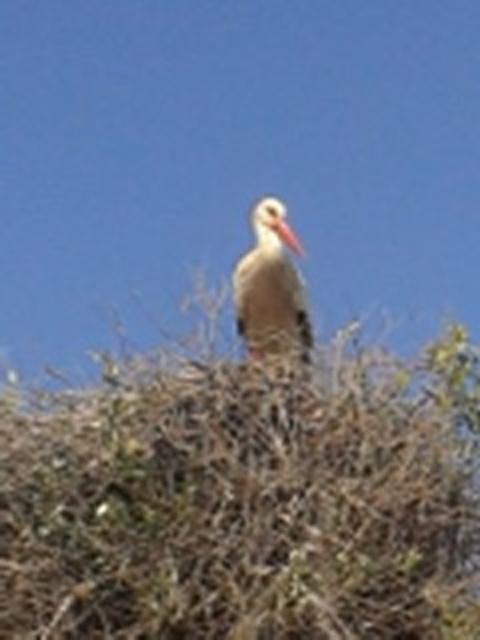
Question: Can you confirm if white matte bird at center is bigger than white matte beak at center?

Choices:
 (A) no
 (B) yes

Answer: (B)

Question: Estimate the real-world distances between objects in this image. Which object is farther from the brown textured nest at upper center?

Choices:
 (A) white matte bird at center
 (B) white matte beak at center

Answer: (B)

Question: Which object is farther from the camera taking this photo?

Choices:
 (A) brown textured nest at upper center
 (B) white matte beak at center
 (C) white matte bird at center

Answer: (B)

Question: Is white matte bird at center thinner than white matte beak at center?

Choices:
 (A) yes
 (B) no

Answer: (B)

Question: Which of the following is the farthest from the observer?

Choices:
 (A) brown textured nest at upper center
 (B) white matte bird at center

Answer: (B)

Question: Considering the relative positions of brown textured nest at upper center and white matte bird at center in the image provided, where is brown textured nest at upper center located with respect to white matte bird at center?

Choices:
 (A) below
 (B) above

Answer: (A)